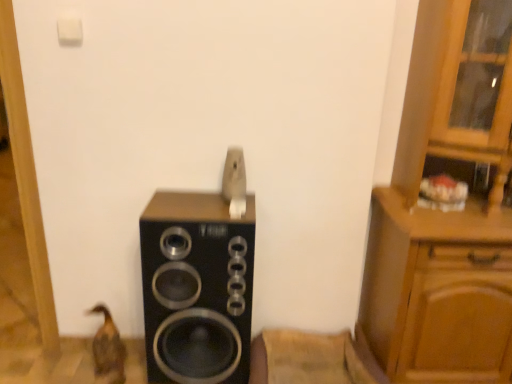
Locate an element on the screen. brown matte duck at lower left is located at coordinates (108, 350).

Is black matte speaker at center spatially inside brown matte duck at lower left, or outside of it?

black matte speaker at center is not inside brown matte duck at lower left, it's outside.

Which is more to the left, black matte speaker at center or brown matte duck at lower left?

brown matte duck at lower left is more to the left.

From the image's perspective, which one is positioned higher, black matte speaker at center or brown matte duck at lower left?

black matte speaker at center.

Is black matte speaker at center facing away from brown matte duck at lower left?

black matte speaker at center is not turned away from brown matte duck at lower left.

From the image's perspective, is wooden cabinet at right below black matte speaker at center?

No.

Is wooden cabinet at right beside black matte speaker at center?

They are not placed beside each other.

Considering the positions of points (472, 291) and (215, 210), is point (472, 291) closer to camera compared to point (215, 210)?

No.

Do you think wooden cabinet at right is within black matte speaker at center, or outside of it?

The correct answer is: outside.

Locate an element on the screen. animal located behind the wooden cabinet at right is located at coordinates [108, 350].

Between point (511, 119) and point (101, 341), which one is positioned behind?

The point (101, 341) is more distant.

Which of these two, wooden cabinet at right or brown matte duck at lower left, stands taller?

With more height is wooden cabinet at right.

What's the angular difference between wooden cabinet at right and brown matte duck at lower left's facing directions?

There is a 3.13-degree angle between the facing directions of wooden cabinet at right and brown matte duck at lower left.

From the image's perspective, which object appears higher, brown matte duck at lower left or wooden cabinet at right?

wooden cabinet at right, from the image's perspective.

Relative to wooden cabinet at right, is brown matte duck at lower left in front or behind?

brown matte duck at lower left is positioned farther from the viewer than wooden cabinet at right.

Between brown matte duck at lower left and wooden cabinet at right, which one appears on the left side from the viewer's perspective?

From the viewer's perspective, brown matte duck at lower left appears more on the left side.

Is wooden cabinet at right a part of brown matte duck at lower left?

No.

The width and height of the screenshot is (512, 384). Identify the location of animal below the black matte speaker at center (from the image's perspective). (108, 350).

From the image's perspective, would you say brown matte duck at lower left is shown under black matte speaker at center?

Indeed, from the image's perspective, brown matte duck at lower left is shown beneath black matte speaker at center.

Considering the relative positions of brown matte duck at lower left and black matte speaker at center in the image provided, is brown matte duck at lower left behind black matte speaker at center?

Yes.

Which of these two, brown matte duck at lower left or black matte speaker at center, is bigger?

Bigger between the two is black matte speaker at center.

From the image's perspective, which one is positioned lower, black matte speaker at center or wooden cabinet at right?

black matte speaker at center.

Is black matte speaker at center positioned with its back to wooden cabinet at right?

black matte speaker at center does not have its back to wooden cabinet at right.

Is point (193, 254) positioned behind point (428, 307)?

No, it is not.

In the image, is black matte speaker at center on the left side or the right side of wooden cabinet at right?

Clearly, black matte speaker at center is on the left of wooden cabinet at right in the image.

This screenshot has width=512, height=384. What are the coordinates of `home appliance that appears in front of the brown matte duck at lower left` in the screenshot? It's located at (197, 289).

You are a GUI agent. You are given a task and a screenshot of the screen. Output one action in this format:
    pyautogui.click(x=<x>, y=<y>)
    Task: Click on the cabinetry lying above the black matte speaker at center (from the image's perspective)
    Image resolution: width=512 pixels, height=384 pixels.
    Given the screenshot: What is the action you would take?
    point(446,210)

Looking at the image, which one is located closer to wooden cabinet at right, black matte speaker at center or brown matte duck at lower left?

black matte speaker at center is positioned closer to the anchor wooden cabinet at right.

Based on the photo, estimate the real-world distances between objects in this image. Which object is further from brown matte duck at lower left, wooden cabinet at right or black matte speaker at center?

wooden cabinet at right.

Looking at this image, when comparing their distances from black matte speaker at center, does brown matte duck at lower left or wooden cabinet at right seem further?

wooden cabinet at right.

Estimate the real-world distances between objects in this image. Which object is closer to wooden cabinet at right, brown matte duck at lower left or black matte speaker at center?

The object closer to wooden cabinet at right is black matte speaker at center.

From the image, which object appears to be nearer to brown matte duck at lower left, black matte speaker at center or wooden cabinet at right?

Based on the image, black matte speaker at center appears to be nearer to brown matte duck at lower left.

From the image, which object appears to be farther from black matte speaker at center, wooden cabinet at right or brown matte duck at lower left?

The object further to black matte speaker at center is wooden cabinet at right.

Locate an element on the screen. The height and width of the screenshot is (384, 512). home appliance located between brown matte duck at lower left and wooden cabinet at right in the left-right direction is located at coordinates (197, 289).